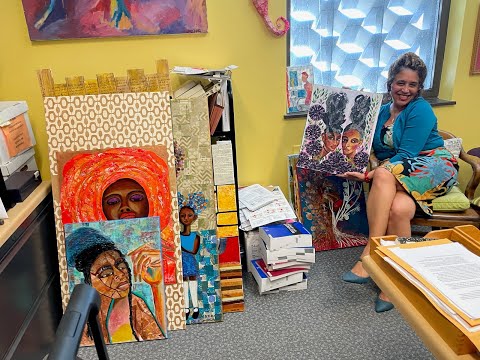
In order to click on window shade in this screenshot , I will do `click(354, 26)`.